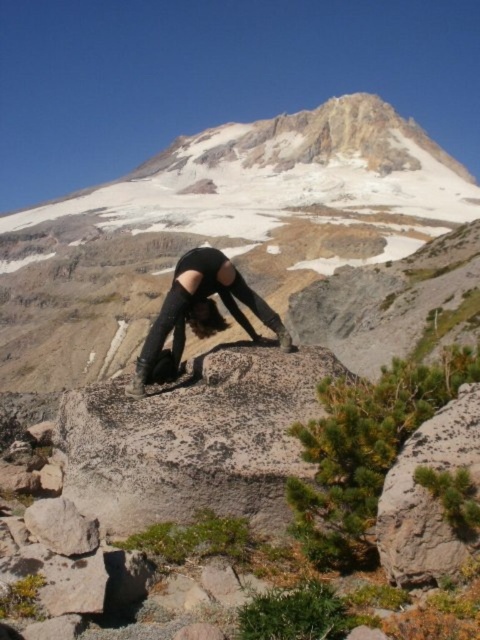
Can you confirm if rocky mountain at center is positioned to the right of black leather boots at center?

Correct, you'll find rocky mountain at center to the right of black leather boots at center.

At what (x,y) coordinates should I click in order to perform the action: click on rocky mountain at center. Please return your answer as a coordinate pair (x, y). The height and width of the screenshot is (640, 480). Looking at the image, I should click on (217, 228).

Between rocky mountain at center and gray rough rock at lower right, which one is positioned higher?

rocky mountain at center is higher up.

Does rocky mountain at center lie behind gray rough rock at lower right?

Yes, it is.

Locate an element on the screen. Image resolution: width=480 pixels, height=640 pixels. rocky mountain at center is located at coordinates (217, 228).

Is gray rough rock at lower right further to the viewer compared to black leather boots at center?

No.

Is gray rough rock at lower right taller than black leather boots at center?

In fact, gray rough rock at lower right may be shorter than black leather boots at center.

Which is in front, point (399, 515) or point (140, 371)?

Point (399, 515) is in front.

What are the coordinates of `gray rough rock at lower right` in the screenshot? It's located at (428, 496).